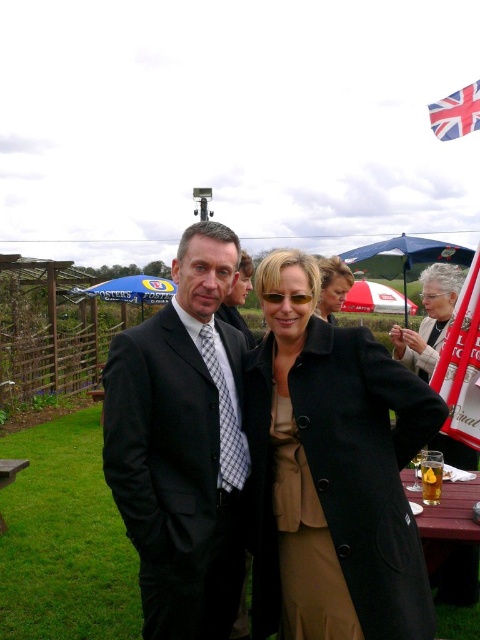
Question: Which point is closer to the camera?

Choices:
 (A) black wool coat at center
 (B) translucent glass mug at center
 (C) union jack fabric at upper right
 (D) matte black suit at center

Answer: (A)

Question: Is black wool coat at center smaller than union jack fabric at upper right?

Choices:
 (A) no
 (B) yes

Answer: (B)

Question: Which point appears farthest from the camera in this image?

Choices:
 (A) (436, 496)
 (B) (459, 100)
 (C) (424, 385)

Answer: (B)

Question: Which of the following is the farthest from the observer?

Choices:
 (A) (230, 344)
 (B) (311, 317)
 (C) (419, 333)

Answer: (C)

Question: Can you confirm if black wool coat at center is positioned above matte black coat at center?

Choices:
 (A) yes
 (B) no

Answer: (B)

Question: Is black wool coat at center further to camera compared to matte black suit at center?

Choices:
 (A) yes
 (B) no

Answer: (B)